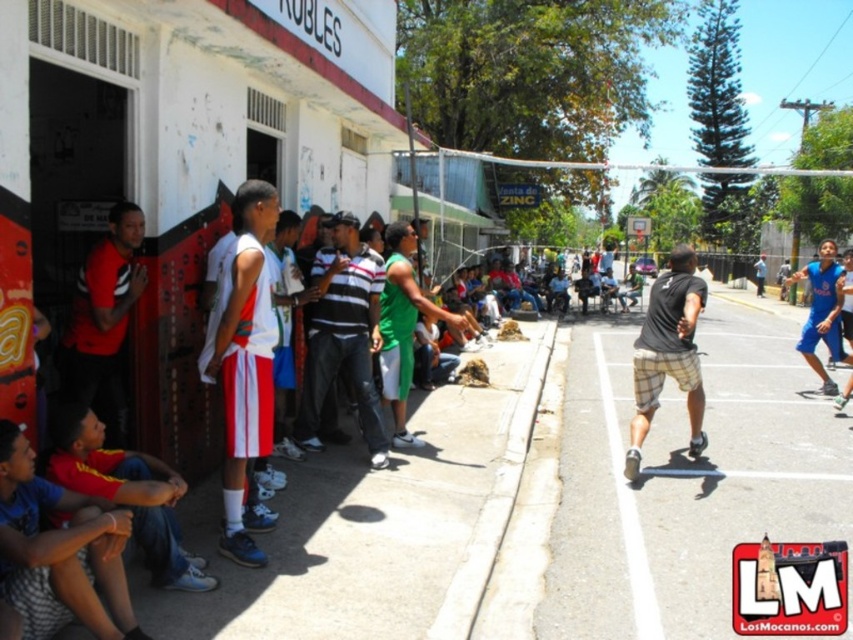
Question: Does black plaid shorts at center have a smaller size compared to plaid shorts at center?

Choices:
 (A) yes
 (B) no

Answer: (B)

Question: Can you confirm if matte blue shorts at lower left is positioned to the right of black plaid shorts at center?

Choices:
 (A) no
 (B) yes

Answer: (A)

Question: Estimate the real-world distances between objects in this image. Which object is farther from the blue shorts at right?

Choices:
 (A) green matte shorts at center
 (B) matte black shirt at left

Answer: (B)

Question: Estimate the real-world distances between objects in this image. Which object is closer to the black plaid shorts at center?

Choices:
 (A) blue shorts at right
 (B) green matte shorts at center
 (C) matte black shirt at left
 (D) smooth asphalt court at center

Answer: (D)

Question: Considering the real-world distances, which object is farthest from the smooth asphalt court at center?

Choices:
 (A) blue shorts at right
 (B) matte blue shorts at lower left
 (C) matte black shirt at left

Answer: (C)

Question: Does matte blue shorts at lower left have a lesser width compared to black plaid shorts at center?

Choices:
 (A) no
 (B) yes

Answer: (B)